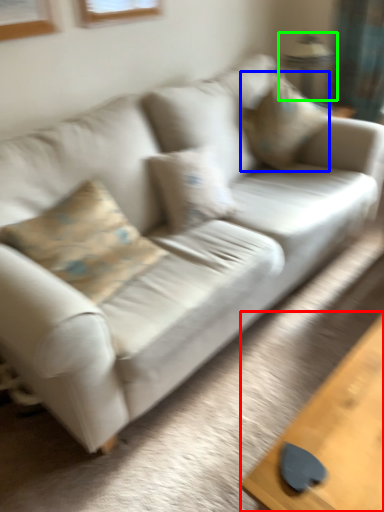
Question: Considering the real-world distances, which object is farthest from table (highlighted by a red box)? pillow (highlighted by a blue box) or lamp (highlighted by a green box)?

Choices:
 (A) pillow
 (B) lamp

Answer: (B)